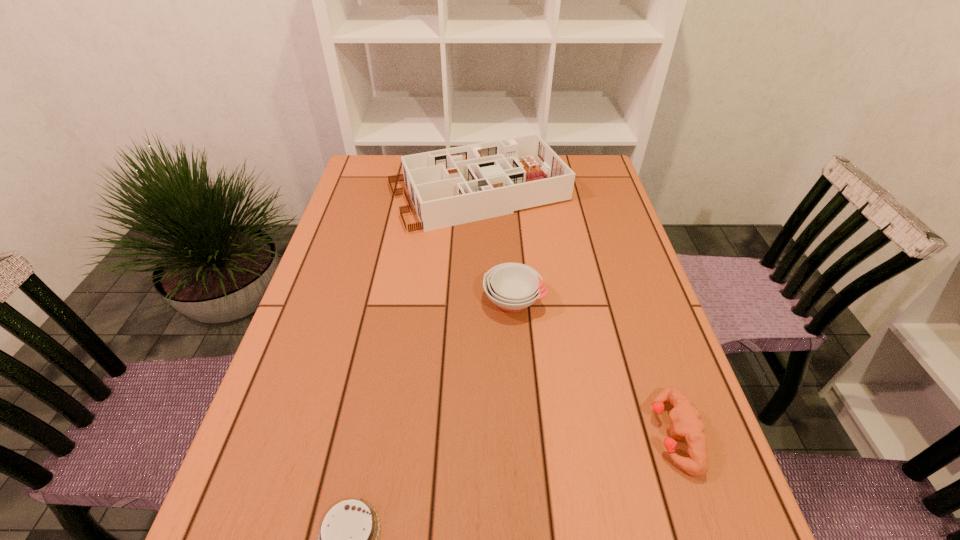
You are a GUI agent. You are given a task and a screenshot of the screen. Output one action in this format:
    pyautogui.click(x=<x>, y=<y>)
    Task: Click on the object at the far edge
    The image size is (960, 540).
    Given the screenshot: What is the action you would take?
    pyautogui.click(x=453, y=186)

The height and width of the screenshot is (540, 960). What are the coordinates of `object at the left edge` in the screenshot? It's located at (453, 186).

I want to click on dollhouse that is at the right edge, so [x=453, y=186].

Find the location of `puncher at the right edge`. puncher at the right edge is located at coordinates (x=686, y=421).

Find the location of `object situated at the far left corner`. object situated at the far left corner is located at coordinates (453, 186).

Where is `object located in the far right corner section of the desktop`? Image resolution: width=960 pixels, height=540 pixels. object located in the far right corner section of the desktop is located at coordinates (453, 186).

You are a GUI agent. You are given a task and a screenshot of the screen. Output one action in this format:
    pyautogui.click(x=<x>, y=<y>)
    Task: Click on the free space at the left edge of the desktop
    This screenshot has height=540, width=960.
    Given the screenshot: What is the action you would take?
    pyautogui.click(x=310, y=299)

Locate an element on the screen. The height and width of the screenshot is (540, 960). free space at the right edge of the desktop is located at coordinates (635, 382).

Where is `vacant space at the far left corner`? vacant space at the far left corner is located at coordinates (393, 172).

The height and width of the screenshot is (540, 960). Find the location of `free space at the far right corner of the desktop`. free space at the far right corner of the desktop is located at coordinates (579, 184).